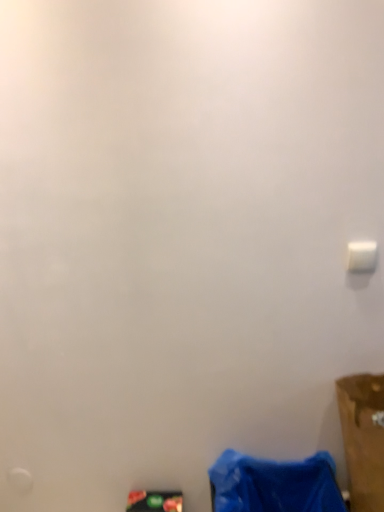
The image size is (384, 512). What do you see at coordinates (155, 501) in the screenshot? I see `matte black phone at lower center, which ranks as the 2th waste in right-to-left order` at bounding box center [155, 501].

Measure the distance between matte black phone at lower center, placed as the 1th waste when sorted from left to right, and camera.

A distance of 4.83 feet exists between matte black phone at lower center, placed as the 1th waste when sorted from left to right, and camera.

Describe the element at coordinates (274, 484) in the screenshot. This screenshot has height=512, width=384. I see `blue fabric bag at lower right, the first waste when ordered from right to left` at that location.

In order to face blue fabric bag at lower right, the first waste when ordered from right to left, should I rotate leftwards or rightwards?

It's best to rotate right around 10.897 degrees.

Identify the location of brown cardboard box at lower right. The height and width of the screenshot is (512, 384). (363, 438).

Where is `white plastic light switch at upper right`? white plastic light switch at upper right is located at coordinates (361, 256).

From the image's perspective, is matte black phone at lower center, which ranks as the 2th waste in right-to-left order, on blue fabric bag at lower right, the first waste when ordered from right to left?

No, from the image's perspective, matte black phone at lower center, which ranks as the 2th waste in right-to-left order, is not on top of blue fabric bag at lower right, the first waste when ordered from right to left.

Is matte black phone at lower center, which ranks as the 2th waste in right-to-left order, with blue fabric bag at lower right, the first waste when ordered from right to left?

matte black phone at lower center, which ranks as the 2th waste in right-to-left order, is not next to blue fabric bag at lower right, the first waste when ordered from right to left, and they're not touching.

Which of these two, matte black phone at lower center, placed as the 1th waste when sorted from left to right, or blue fabric bag at lower right, acting as the second waste starting from the left, is thinner?

matte black phone at lower center, placed as the 1th waste when sorted from left to right, is thinner.

Do you think matte black phone at lower center, placed as the 1th waste when sorted from left to right, is within blue fabric bag at lower right, acting as the second waste starting from the left, or outside of it?

matte black phone at lower center, placed as the 1th waste when sorted from left to right, lies outside blue fabric bag at lower right, acting as the second waste starting from the left.

Between matte black phone at lower center, placed as the 1th waste when sorted from left to right, and white plastic light switch at upper right, which one has smaller size?

Smaller between the two is white plastic light switch at upper right.

Considering the sizes of objects matte black phone at lower center, placed as the 1th waste when sorted from left to right, and white plastic light switch at upper right in the image provided, who is taller, matte black phone at lower center, placed as the 1th waste when sorted from left to right, or white plastic light switch at upper right?

matte black phone at lower center, placed as the 1th waste when sorted from left to right, is taller.

How many degrees apart are the facing directions of matte black phone at lower center, placed as the 1th waste when sorted from left to right, and white plastic light switch at upper right?

179 degrees separate the facing orientations of matte black phone at lower center, placed as the 1th waste when sorted from left to right, and white plastic light switch at upper right.

You are a GUI agent. You are given a task and a screenshot of the screen. Output one action in this format:
    pyautogui.click(x=<x>, y=<y>)
    Task: Click on the waste that appears in front of the white plastic light switch at upper right
    This screenshot has height=512, width=384.
    Given the screenshot: What is the action you would take?
    pyautogui.click(x=274, y=484)

Is blue fabric bag at lower right, acting as the second waste starting from the left, outside of white plastic light switch at upper right?

Yes.

In the scene shown: How different are the orientations of blue fabric bag at lower right, acting as the second waste starting from the left, and white plastic light switch at upper right in degrees?

The angle between the facing direction of blue fabric bag at lower right, acting as the second waste starting from the left, and the facing direction of white plastic light switch at upper right is 179 degrees.

Consider the image. Considering the relative sizes of blue fabric bag at lower right, acting as the second waste starting from the left, and white plastic light switch at upper right in the image provided, is blue fabric bag at lower right, acting as the second waste starting from the left, shorter than white plastic light switch at upper right?

No, blue fabric bag at lower right, acting as the second waste starting from the left, is not shorter than white plastic light switch at upper right.

Considering the sizes of objects brown cardboard box at lower right and matte black phone at lower center, which ranks as the 2th waste in right-to-left order, in the image provided, who is wider, brown cardboard box at lower right or matte black phone at lower center, which ranks as the 2th waste in right-to-left order,?

brown cardboard box at lower right.

Is brown cardboard box at lower right positioned far away from matte black phone at lower center, placed as the 1th waste when sorted from left to right?

brown cardboard box at lower right is near matte black phone at lower center, placed as the 1th waste when sorted from left to right, not far away.

Is brown cardboard box at lower right oriented towards matte black phone at lower center, placed as the 1th waste when sorted from left to right?

No, brown cardboard box at lower right is not turned towards matte black phone at lower center, placed as the 1th waste when sorted from left to right.

Who is smaller, brown cardboard box at lower right or matte black phone at lower center, placed as the 1th waste when sorted from left to right?

With smaller size is matte black phone at lower center, placed as the 1th waste when sorted from left to right.

Based on the photo, looking at their sizes, would you say white plastic light switch at upper right is wider or thinner than blue fabric bag at lower right, the first waste when ordered from right to left?

white plastic light switch at upper right is thinner than blue fabric bag at lower right, the first waste when ordered from right to left.

Which of these two, white plastic light switch at upper right or blue fabric bag at lower right, the first waste when ordered from right to left, is smaller?

With smaller size is white plastic light switch at upper right.

Is white plastic light switch at upper right placed right next to blue fabric bag at lower right, acting as the second waste starting from the left?

No, white plastic light switch at upper right is not in contact with blue fabric bag at lower right, acting as the second waste starting from the left.

Identify the location of waste in front of the white plastic light switch at upper right. Image resolution: width=384 pixels, height=512 pixels. (274, 484).

Does white plastic light switch at upper right have a lesser height compared to matte black phone at lower center, placed as the 1th waste when sorted from left to right?

Yes, white plastic light switch at upper right is shorter than matte black phone at lower center, placed as the 1th waste when sorted from left to right.

Considering the positions of objects white plastic light switch at upper right and matte black phone at lower center, which ranks as the 2th waste in right-to-left order, in the image provided, who is in front, white plastic light switch at upper right or matte black phone at lower center, which ranks as the 2th waste in right-to-left order,?

white plastic light switch at upper right is closer to the camera.

Is white plastic light switch at upper right outside of matte black phone at lower center, which ranks as the 2th waste in right-to-left order?

white plastic light switch at upper right is positioned outside matte black phone at lower center, which ranks as the 2th waste in right-to-left order.

Is matte black phone at lower center, which ranks as the 2th waste in right-to-left order, far from brown cardboard box at lower right?

No, matte black phone at lower center, which ranks as the 2th waste in right-to-left order, is not far from brown cardboard box at lower right.

Which object is wider, matte black phone at lower center, placed as the 1th waste when sorted from left to right, or brown cardboard box at lower right?

Wider between the two is brown cardboard box at lower right.

Consider the image. Between matte black phone at lower center, placed as the 1th waste when sorted from left to right, and brown cardboard box at lower right, which one is positioned behind?

matte black phone at lower center, placed as the 1th waste when sorted from left to right, is further from the camera.

The width and height of the screenshot is (384, 512). Identify the location of waste on the right of matte black phone at lower center, placed as the 1th waste when sorted from left to right. (274, 484).

I want to click on light switch above the matte black phone at lower center, placed as the 1th waste when sorted from left to right (from a real-world perspective), so click(361, 256).

Based on their spatial positions, is matte black phone at lower center, which ranks as the 2th waste in right-to-left order, or blue fabric bag at lower right, the first waste when ordered from right to left, further from brown cardboard box at lower right?

Among the two, matte black phone at lower center, which ranks as the 2th waste in right-to-left order, is located further to brown cardboard box at lower right.

Based on their spatial positions, is blue fabric bag at lower right, acting as the second waste starting from the left, or white plastic light switch at upper right closer to brown cardboard box at lower right?

blue fabric bag at lower right, acting as the second waste starting from the left.

When comparing their distances from white plastic light switch at upper right, does blue fabric bag at lower right, acting as the second waste starting from the left, or matte black phone at lower center, which ranks as the 2th waste in right-to-left order, seem closer?

Among the two, blue fabric bag at lower right, acting as the second waste starting from the left, is located nearer to white plastic light switch at upper right.

Which object lies further to the anchor point brown cardboard box at lower right, matte black phone at lower center, which ranks as the 2th waste in right-to-left order, or white plastic light switch at upper right?

Based on the image, matte black phone at lower center, which ranks as the 2th waste in right-to-left order, appears to be further to brown cardboard box at lower right.

When comparing their distances from matte black phone at lower center, which ranks as the 2th waste in right-to-left order, does white plastic light switch at upper right or blue fabric bag at lower right, the first waste when ordered from right to left, seem closer?

blue fabric bag at lower right, the first waste when ordered from right to left, is closer to matte black phone at lower center, which ranks as the 2th waste in right-to-left order.

From the image, which object appears to be farther from brown cardboard box at lower right, white plastic light switch at upper right or matte black phone at lower center, which ranks as the 2th waste in right-to-left order?

Among the two, matte black phone at lower center, which ranks as the 2th waste in right-to-left order, is located further to brown cardboard box at lower right.

Which object lies further to the anchor point white plastic light switch at upper right, blue fabric bag at lower right, the first waste when ordered from right to left, or brown cardboard box at lower right?

The object further to white plastic light switch at upper right is blue fabric bag at lower right, the first waste when ordered from right to left.

Based on their spatial positions, is white plastic light switch at upper right or matte black phone at lower center, which ranks as the 2th waste in right-to-left order, closer to blue fabric bag at lower right, acting as the second waste starting from the left?

The object closer to blue fabric bag at lower right, acting as the second waste starting from the left, is matte black phone at lower center, which ranks as the 2th waste in right-to-left order.

You are a GUI agent. You are given a task and a screenshot of the screen. Output one action in this format:
    pyautogui.click(x=<x>, y=<y>)
    Task: Click on the furniture that lies between white plastic light switch at upper right and blue fabric bag at lower right, acting as the second waste starting from the left, from top to bottom
    This screenshot has width=384, height=512.
    Given the screenshot: What is the action you would take?
    pyautogui.click(x=363, y=438)

Identify the location of waste situated between matte black phone at lower center, placed as the 1th waste when sorted from left to right, and brown cardboard box at lower right from left to right. (274, 484).

Identify the location of waste between white plastic light switch at upper right and matte black phone at lower center, which ranks as the 2th waste in right-to-left order, vertically. (274, 484).

Locate an element on the screen. This screenshot has height=512, width=384. furniture between white plastic light switch at upper right and matte black phone at lower center, which ranks as the 2th waste in right-to-left order, vertically is located at coordinates (363, 438).